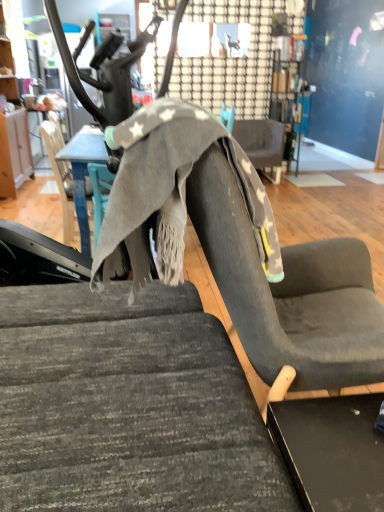
Question: Is gray fabric chair at center, which appears as the 3th chair when viewed from the left, positioned with its back to textured gray fabric swivel chair at center?

Choices:
 (A) yes
 (B) no

Answer: (B)

Question: Does gray fabric chair at center, the 1th chair in the back-to-front sequence, touch textured gray fabric swivel chair at center?

Choices:
 (A) yes
 (B) no

Answer: (B)

Question: Is textured gray fabric swivel chair at center a part of gray fabric chair at center, positioned as the third chair in bottom-to-top order?

Choices:
 (A) yes
 (B) no

Answer: (B)

Question: Can you confirm if gray fabric chair at center, acting as the first chair starting from the top, is wider than textured gray fabric swivel chair at center?

Choices:
 (A) yes
 (B) no

Answer: (B)

Question: Does gray fabric chair at center, which ranks as the first chair in right-to-left order, have a lesser width compared to textured gray fabric swivel chair at center?

Choices:
 (A) yes
 (B) no

Answer: (A)

Question: From the image's perspective, relative to wooden cabinet at left, is gray fabric table at center above or below?

Choices:
 (A) below
 (B) above

Answer: (A)

Question: From a real-world perspective, is gray fabric table at center positioned above or below wooden cabinet at left?

Choices:
 (A) below
 (B) above

Answer: (A)

Question: Considering their positions, is gray fabric table at center located in front of or behind wooden cabinet at left?

Choices:
 (A) behind
 (B) front

Answer: (B)

Question: Is gray fabric table at center bigger or smaller than wooden cabinet at left?

Choices:
 (A) small
 (B) big

Answer: (A)

Question: Looking at their shapes, would you say textured gray fabric swivel chair at center is wider or thinner than wooden cabinet at left?

Choices:
 (A) wide
 (B) thin

Answer: (A)

Question: From the image's perspective, relative to wooden cabinet at left, is textured gray fabric swivel chair at center above or below?

Choices:
 (A) above
 (B) below

Answer: (B)

Question: From their relative heights in the image, would you say textured gray fabric swivel chair at center is taller or shorter than wooden cabinet at left?

Choices:
 (A) tall
 (B) short

Answer: (B)

Question: From a real-world perspective, is textured gray fabric swivel chair at center positioned above or below wooden cabinet at left?

Choices:
 (A) below
 (B) above

Answer: (A)

Question: Looking at the image, does textured gray fabric chair at center, the 3th chair viewed from the top, seem bigger or smaller compared to textured gray fabric swivel chair at center?

Choices:
 (A) small
 (B) big

Answer: (B)

Question: Considering the positions of textured gray fabric chair at center, the second chair viewed from the left, and textured gray fabric swivel chair at center in the image, is textured gray fabric chair at center, the second chair viewed from the left, taller or shorter than textured gray fabric swivel chair at center?

Choices:
 (A) tall
 (B) short

Answer: (B)